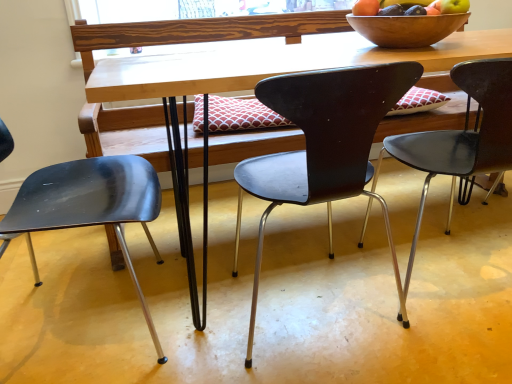
Identify the location of vacant area situated below metallic black chair at left, arranged as the first chair when viewed from the left (from a real-world perspective). The width and height of the screenshot is (512, 384). (79, 317).